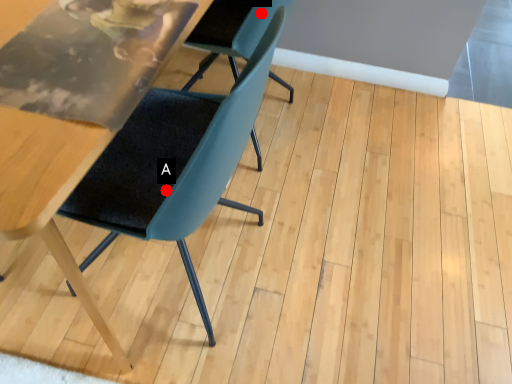
Question: Two points are circled on the image, labeled by A and B beside each circle. Which point is closer to the camera taking this photo?

Choices:
 (A) A is closer
 (B) B is closer

Answer: (A)